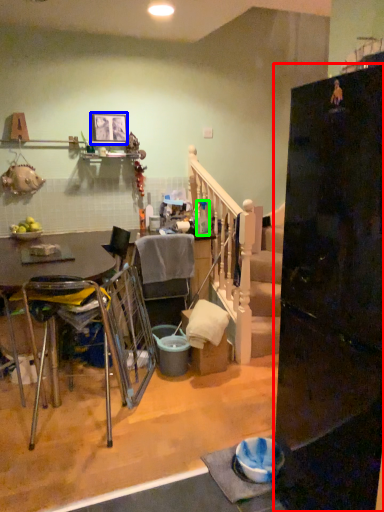
Question: Based on their relative distances, which object is farther from refrigerator (highlighted by a red box)? Choose from picture frame (highlighted by a blue box) and bottle (highlighted by a green box).

Choices:
 (A) picture frame
 (B) bottle

Answer: (A)